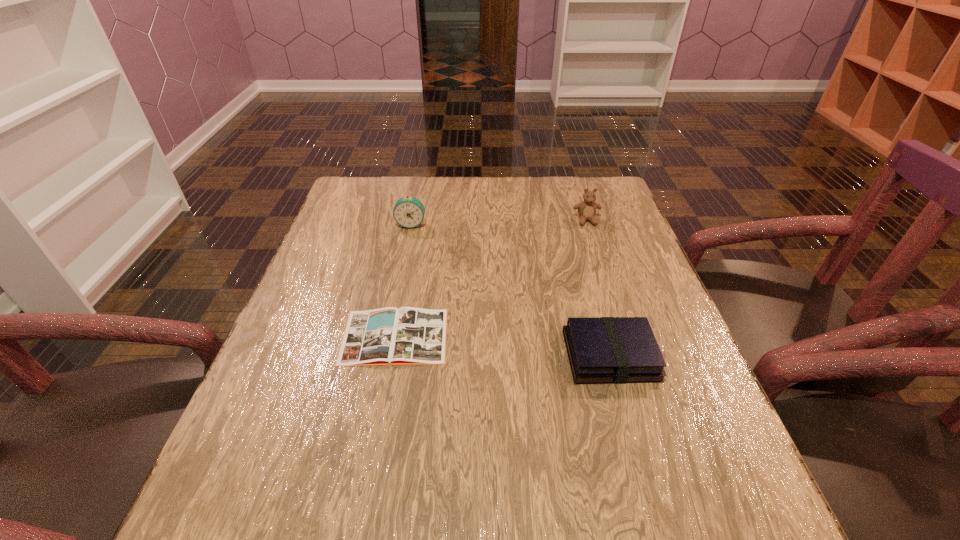
Find the location of a particular element. The width and height of the screenshot is (960, 540). free space that is in between the second shortest object and the shortest object is located at coordinates (502, 346).

Where is `free spot between the left book and the teddy bear`? The image size is (960, 540). free spot between the left book and the teddy bear is located at coordinates (491, 279).

Locate an element on the screen. This screenshot has width=960, height=540. free space between the teddy bear and the right book is located at coordinates (598, 288).

You are a GUI agent. You are given a task and a screenshot of the screen. Output one action in this format:
    pyautogui.click(x=<x>, y=<y>)
    Task: Click on the free area in between the shortest object and the alarm clock
    
    Given the screenshot: What is the action you would take?
    pyautogui.click(x=403, y=280)

Identify which object is the second closest to the teddy bear. Please provide its 2D coordinates. Your answer should be formatted as a tuple, i.e. [(x, y)], where the tuple contains the x and y coordinates of a point satisfying the conditions above.

[(409, 212)]

Identify the location of the third closest object to the shorter book. (586, 209).

Where is `vacant space that satisfies the following two spatial constraints: 1. on the front-facing side of the alarm clock; 2. on the right side of the right book`? The image size is (960, 540). vacant space that satisfies the following two spatial constraints: 1. on the front-facing side of the alarm clock; 2. on the right side of the right book is located at coordinates (384, 355).

Locate an element on the screen. This screenshot has height=540, width=960. vacant area in the image that satisfies the following two spatial constraints: 1. on the front side of the shortest object; 2. on the right side of the third tallest object is located at coordinates (391, 355).

You are a GUI agent. You are given a task and a screenshot of the screen. Output one action in this format:
    pyautogui.click(x=<x>, y=<y>)
    Task: Click on the free location that satisfies the following two spatial constraints: 1. on the front-facing side of the alarm clock; 2. on the left side of the shorter book
    The height and width of the screenshot is (540, 960).
    Given the screenshot: What is the action you would take?
    [x=388, y=336]